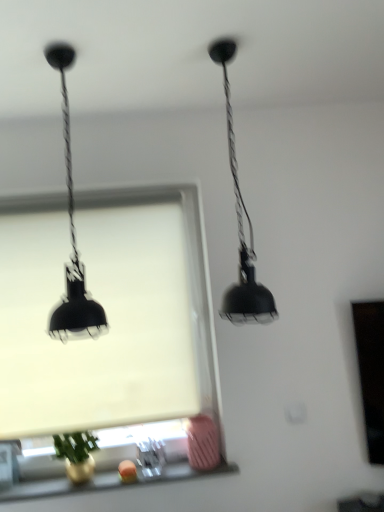
Question: Considering the relative sizes of matte black lamp at left, the first lamp viewed from the left, and matte glass window sill at lower center in the image provided, is matte black lamp at left, the first lamp viewed from the left, shorter than matte glass window sill at lower center?

Choices:
 (A) no
 (B) yes

Answer: (A)

Question: Is the position of matte black lamp at left, acting as the second lamp starting from the right, less distant than that of matte glass window sill at lower center?

Choices:
 (A) no
 (B) yes

Answer: (B)

Question: Considering the relative sizes of matte black lamp at left, the first lamp viewed from the left, and matte glass window sill at lower center in the image provided, is matte black lamp at left, the first lamp viewed from the left, thinner than matte glass window sill at lower center?

Choices:
 (A) yes
 (B) no

Answer: (B)

Question: Does matte black lamp at left, acting as the second lamp starting from the right, have a greater height compared to matte glass window sill at lower center?

Choices:
 (A) no
 (B) yes

Answer: (B)

Question: From the image's perspective, does matte black lamp at left, the first lamp viewed from the left, appear lower than matte glass window sill at lower center?

Choices:
 (A) no
 (B) yes

Answer: (A)

Question: From the image's perspective, is black matte pendant light at upper center, which is counted as the second lamp, starting from the left, positioned above or below matte glass window sill at lower center?

Choices:
 (A) below
 (B) above

Answer: (B)

Question: Is point (244, 290) positioned closer to the camera than point (0, 499)?

Choices:
 (A) farther
 (B) closer

Answer: (B)

Question: From a real-world perspective, is black matte pendant light at upper center, which is counted as the second lamp, starting from the left, positioned above or below matte glass window sill at lower center?

Choices:
 (A) below
 (B) above

Answer: (B)

Question: Considering the positions of black matte pendant light at upper center, which is counted as the second lamp, starting from the left, and matte glass window sill at lower center in the image, is black matte pendant light at upper center, which is counted as the second lamp, starting from the left, taller or shorter than matte glass window sill at lower center?

Choices:
 (A) tall
 (B) short

Answer: (A)

Question: In terms of height, does white matte window screen at center look taller or shorter compared to matte glass window sill at lower center?

Choices:
 (A) short
 (B) tall

Answer: (B)

Question: From a real-world perspective, is white matte window screen at center physically located above or below matte glass window sill at lower center?

Choices:
 (A) above
 (B) below

Answer: (A)

Question: Considering the positions of point (51, 411) and point (46, 481), is point (51, 411) closer or farther from the camera than point (46, 481)?

Choices:
 (A) closer
 (B) farther

Answer: (B)

Question: Is white matte window screen at center in front of or behind matte glass window sill at lower center in the image?

Choices:
 (A) front
 (B) behind

Answer: (B)

Question: Does point (71, 272) appear closer or farther from the camera than point (246, 320)?

Choices:
 (A) closer
 (B) farther

Answer: (B)

Question: Considering the positions of matte black lamp at left, acting as the second lamp starting from the right, and black matte pendant light at upper center, which is counted as the second lamp, starting from the left, in the image, is matte black lamp at left, acting as the second lamp starting from the right, wider or thinner than black matte pendant light at upper center, which is counted as the second lamp, starting from the left,?

Choices:
 (A) thin
 (B) wide

Answer: (B)